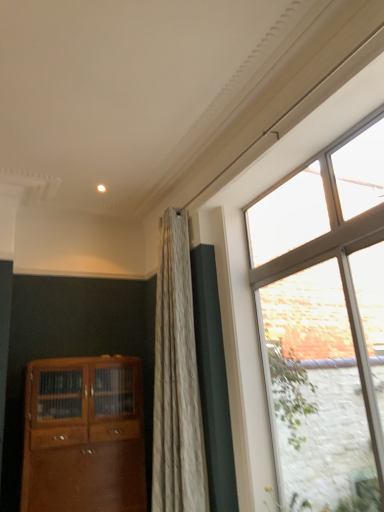
Measure the distance between point (x=116, y=391) and camera.

Point (x=116, y=391) is 3.24 meters from camera.

Identify the location of clear glass window at right. This screenshot has width=384, height=512. (321, 316).

What's the angular difference between matte wood cabinet at lower left and clear glass door at right's facing directions?

89.4 degrees.

Who is taller, matte wood cabinet at lower left or clear glass door at right?

With more height is clear glass door at right.

Is point (64, 419) farther from viewer compared to point (366, 368)?

Yes, it is behind point (366, 368).

Measure the distance between matte wood cabinet at lower left and clear glass window at right.

They are 4.53 feet apart.

Looking at the image, does matte wood cabinet at lower left seem bigger or smaller compared to clear glass window at right?

In the image, matte wood cabinet at lower left appears to be larger than clear glass window at right.

From the image's perspective, which one is positioned higher, matte wood cabinet at lower left or clear glass window at right?

clear glass window at right is shown above in the image.

Which of these two, clear glass door at right or matte wood cabinet at lower left, is thinner?

clear glass door at right.

Measure the distance from clear glass door at right to matte wood cabinet at lower left.

clear glass door at right is 6.26 feet away from matte wood cabinet at lower left.

Who is shorter, clear glass door at right or matte wood cabinet at lower left?

With less height is matte wood cabinet at lower left.

From the image's perspective, is clear glass door at right under matte wood cabinet at lower left?

No.

Which point is more distant from viewer, (380, 398) or (383, 116)?

The point (383, 116) is farther.

Between clear glass door at right and clear glass window at right, which one has less height?

clear glass door at right is shorter.

From the image's perspective, is clear glass door at right under clear glass window at right?

Actually, clear glass door at right appears above clear glass window at right in the image.

Can you see clear glass door at right touching clear glass window at right?

clear glass door at right and clear glass window at right are clearly separated.

Can you confirm if clear glass window at right is positioned to the left of clear glass door at right?

Yes.

Is clear glass window at right turned away from clear glass door at right?

That's not correct — clear glass window at right is not looking away from clear glass door at right.

Would you say clear glass door at right is part of clear glass window at right's contents?

Actually, clear glass door at right is outside clear glass window at right.

Is clear glass window at right at the right side of matte wood cabinet at lower left?

Yes, clear glass window at right is to the right of matte wood cabinet at lower left.

Is clear glass window at right far away from matte wood cabinet at lower left?

clear glass window at right is far away from matte wood cabinet at lower left.

Which of these two, clear glass window at right or matte wood cabinet at lower left, is thinner?

Thinner between the two is clear glass window at right.

Looking at this image, is clear glass window at right not within matte wood cabinet at lower left?

Yes.

Identify the location of glass door on the right of matte wood cabinet at lower left. (368, 335).

Image resolution: width=384 pixels, height=512 pixels. What are the coordinates of `cabinetry beneath the clear glass window at right (from a real-world perspective)` in the screenshot? It's located at (84, 436).

Based on the photo, estimate the real-world distances between objects in this image. Which object is further from clear glass window at right, matte wood cabinet at lower left or clear glass door at right?

matte wood cabinet at lower left is positioned further to the anchor clear glass window at right.

Based on their spatial positions, is matte wood cabinet at lower left or clear glass window at right further from clear glass door at right?

Based on the image, matte wood cabinet at lower left appears to be further to clear glass door at right.

Considering their positions, is clear glass window at right positioned closer to clear glass door at right than matte wood cabinet at lower left?

Among the two, clear glass window at right is located nearer to clear glass door at right.

When comparing their distances from clear glass window at right, does clear glass door at right or matte wood cabinet at lower left seem closer?

clear glass door at right.

Looking at the image, which one is located further to matte wood cabinet at lower left, clear glass door at right or clear glass window at right?

Among the two, clear glass door at right is located further to matte wood cabinet at lower left.

Considering their positions, is clear glass window at right positioned further to matte wood cabinet at lower left than clear glass door at right?

clear glass door at right.

Where is `window situated between matte wood cabinet at lower left and clear glass door at right from left to right`? The image size is (384, 512). window situated between matte wood cabinet at lower left and clear glass door at right from left to right is located at coordinates (321, 316).